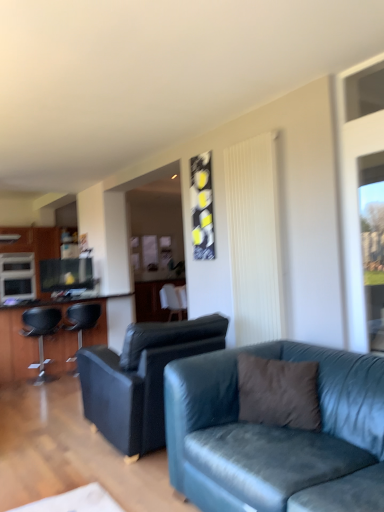
Question: From a real-world perspective, is matte black cabinet at left positioned under matte black bar stool at left, placed as the 3th chair when sorted from right to left, based on gravity?

Choices:
 (A) yes
 (B) no

Answer: (B)

Question: Is matte black cabinet at left at the right side of matte black bar stool at left, placed as the 3th chair when sorted from right to left?

Choices:
 (A) yes
 (B) no

Answer: (B)

Question: Can you confirm if matte black cabinet at left is smaller than matte black bar stool at left, the third chair in the back-to-front sequence?

Choices:
 (A) yes
 (B) no

Answer: (B)

Question: Could matte black bar stool at left, the 1th chair viewed from the left, be considered to be inside matte black cabinet at left?

Choices:
 (A) no
 (B) yes

Answer: (A)

Question: Is matte black cabinet at left facing towards matte black bar stool at left, placed as the 3th chair when sorted from right to left?

Choices:
 (A) yes
 (B) no

Answer: (A)

Question: Does matte black cabinet at left come in front of matte black bar stool at left, the third chair in the back-to-front sequence?

Choices:
 (A) yes
 (B) no

Answer: (B)

Question: Is matte black entertainment center at left looking in the opposite direction of white textured curtain at center?

Choices:
 (A) yes
 (B) no

Answer: (B)

Question: Is matte black entertainment center at left positioned far away from white textured curtain at center?

Choices:
 (A) no
 (B) yes

Answer: (B)

Question: Can you confirm if matte black entertainment center at left is wider than white textured curtain at center?

Choices:
 (A) no
 (B) yes

Answer: (B)

Question: From the image's perspective, would you say matte black entertainment center at left is positioned over white textured curtain at center?

Choices:
 (A) yes
 (B) no

Answer: (B)

Question: Does matte black entertainment center at left come in front of white textured curtain at center?

Choices:
 (A) no
 (B) yes

Answer: (A)

Question: Is matte black entertainment center at left to the right of white textured curtain at center from the viewer's perspective?

Choices:
 (A) no
 (B) yes

Answer: (A)

Question: From a real-world perspective, does matte black cabinet at left stand above white fabric chair at center, positioned as the third chair in left-to-right order?

Choices:
 (A) no
 (B) yes

Answer: (B)